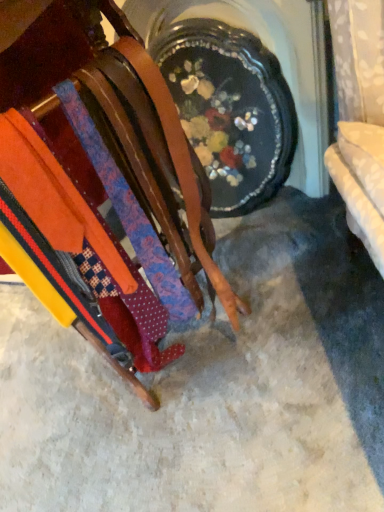
What is the approximate height of wooden rack of ties at center?

wooden rack of ties at center is 37.38 inches in height.

Locate an element on the screen. The image size is (384, 512). wooden rack of ties at center is located at coordinates (104, 168).

Describe the element at coordinates (104, 168) in the screenshot. The image size is (384, 512). I see `wooden rack of ties at center` at that location.

What do you see at coordinates (213, 389) in the screenshot?
I see `orange fabric at left` at bounding box center [213, 389].

The image size is (384, 512). I want to click on orange fabric at left, so click(213, 389).

What is the approximate height of orange fabric at left?

orange fabric at left is 2.65 inches in height.

The width and height of the screenshot is (384, 512). In order to click on wooden rack of ties at center in this screenshot , I will do point(104,168).

In the scene shown: Would you say wooden rack of ties at center is to the left or to the right of orange fabric at left in the picture?

wooden rack of ties at center is positioned on orange fabric at left's left side.

Which is behind, wooden rack of ties at center or orange fabric at left?

orange fabric at left is more distant.

Which point is more forward, (x=146, y=405) or (x=20, y=428)?

Positioned in front is point (x=146, y=405).

From the image's perspective, is wooden rack of ties at center below orange fabric at left?

Actually, wooden rack of ties at center appears above orange fabric at left in the image.

From a real-world perspective, is wooden rack of ties at center physically below orange fabric at left?

No, from a real-world perspective, wooden rack of ties at center is not beneath orange fabric at left.

Does wooden rack of ties at center have a lesser width compared to orange fabric at left?

Correct, the width of wooden rack of ties at center is less than that of orange fabric at left.

From their relative heights in the image, would you say wooden rack of ties at center is taller or shorter than orange fabric at left?

wooden rack of ties at center is taller than orange fabric at left.

Looking at the image, does wooden rack of ties at center seem bigger or smaller compared to orange fabric at left?

wooden rack of ties at center is bigger than orange fabric at left.

Which is correct: wooden rack of ties at center is inside orange fabric at left, or outside of it?

wooden rack of ties at center cannot be found inside orange fabric at left.

Is wooden rack of ties at center positioned far away from orange fabric at left?

No, wooden rack of ties at center is not far away from orange fabric at left.

Is wooden rack of ties at center oriented towards orange fabric at left?

No, wooden rack of ties at center is not turned towards orange fabric at left.

At what (x,y) coordinates should I click in order to perform the action: click on furniture above the orange fabric at left (from the image's perspective). Please return your answer as a coordinate pair (x, y). The image size is (384, 512). Looking at the image, I should click on (104, 168).

Which is more to the right, orange fabric at left or wooden rack of ties at center?

From the viewer's perspective, orange fabric at left appears more on the right side.

Which object is further away from the camera taking this photo, orange fabric at left or wooden rack of ties at center?

orange fabric at left is more distant.

Does point (349, 474) come farther from viewer compared to point (72, 146)?

No.

From the image's perspective, which one is positioned lower, orange fabric at left or wooden rack of ties at center?

orange fabric at left.

From a real-world perspective, which object stands above the other?

In real-world perspective, wooden rack of ties at center is above.

Looking at their sizes, would you say orange fabric at left is wider or thinner than wooden rack of ties at center?

Considering their sizes, orange fabric at left looks broader than wooden rack of ties at center.

Based on the photo, can you confirm if orange fabric at left is taller than wooden rack of ties at center?

Incorrect, the height of orange fabric at left is not larger of that of wooden rack of ties at center.

Is orange fabric at left smaller than wooden rack of ties at center?

Yes.

Do you think orange fabric at left is within wooden rack of ties at center, or outside of it?

orange fabric at left is spatially situated outside wooden rack of ties at center.

Are orange fabric at left and wooden rack of ties at center making contact?

No.

Is orange fabric at left aimed at wooden rack of ties at center?

No.

At what (x,y) coordinates should I click in order to perform the action: click on concrete below the wooden rack of ties at center (from the image's perspective). Please return your answer as a coordinate pair (x, y). Looking at the image, I should click on (213, 389).

Locate an element on the screen. This screenshot has height=512, width=384. concrete that is behind the wooden rack of ties at center is located at coordinates (213, 389).

In the image, there is a wooden rack of ties at center. Identify the location of concrete below it (from the image's perspective). The image size is (384, 512). (213, 389).